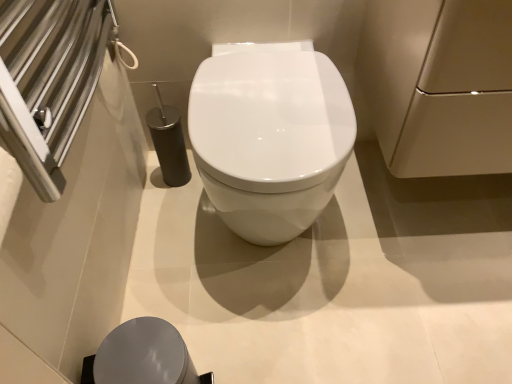
Question: Considering the relative sizes of matte beige cabinet at upper right and white glossy toilet at center in the image provided, is matte beige cabinet at upper right wider than white glossy toilet at center?

Choices:
 (A) yes
 (B) no

Answer: (B)

Question: Are matte beige cabinet at upper right and white glossy toilet at center beside each other?

Choices:
 (A) no
 (B) yes

Answer: (A)

Question: Can you confirm if matte beige cabinet at upper right is positioned to the left of white glossy toilet at center?

Choices:
 (A) no
 (B) yes

Answer: (A)

Question: Can you confirm if matte beige cabinet at upper right is positioned to the right of white glossy toilet at center?

Choices:
 (A) no
 (B) yes

Answer: (B)

Question: From the image's perspective, is matte beige cabinet at upper right beneath white glossy toilet at center?

Choices:
 (A) yes
 (B) no

Answer: (B)

Question: Can you confirm if matte beige cabinet at upper right is taller than white glossy toilet at center?

Choices:
 (A) no
 (B) yes

Answer: (A)

Question: Is matte gray lid at lower center positioned with its back to matte beige cabinet at upper right?

Choices:
 (A) yes
 (B) no

Answer: (B)

Question: Considering the relative positions of matte gray lid at lower center and matte beige cabinet at upper right in the image provided, is matte gray lid at lower center to the left of matte beige cabinet at upper right from the viewer's perspective?

Choices:
 (A) yes
 (B) no

Answer: (A)

Question: Is matte gray lid at lower center closer to the viewer compared to matte beige cabinet at upper right?

Choices:
 (A) yes
 (B) no

Answer: (B)

Question: Considering the relative sizes of matte gray lid at lower center and matte beige cabinet at upper right in the image provided, is matte gray lid at lower center taller than matte beige cabinet at upper right?

Choices:
 (A) no
 (B) yes

Answer: (A)

Question: Is matte gray lid at lower center facing towards matte beige cabinet at upper right?

Choices:
 (A) yes
 (B) no

Answer: (B)

Question: Can you confirm if matte gray lid at lower center is bigger than matte beige cabinet at upper right?

Choices:
 (A) no
 (B) yes

Answer: (A)

Question: From a real-world perspective, is white glossy toilet at center located higher than matte beige cabinet at upper right?

Choices:
 (A) no
 (B) yes

Answer: (A)